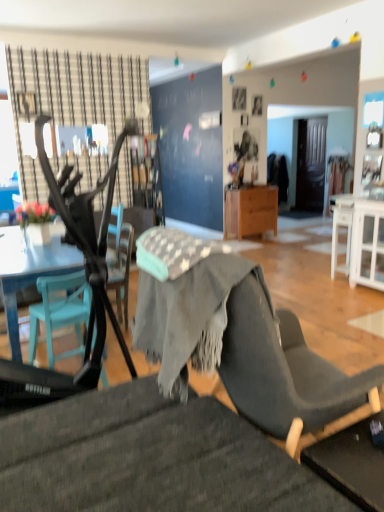
Question: Is teal plastic chair at left, the first chair viewed from the back, looking in the opposite direction of wooden picture frame at upper center, which appears as the second picture frame when viewed from the left?

Choices:
 (A) yes
 (B) no

Answer: (B)

Question: Is teal plastic chair at left, the first chair viewed from the back, not within wooden picture frame at upper center, which appears as the second picture frame when viewed from the left?

Choices:
 (A) no
 (B) yes

Answer: (B)

Question: Can you confirm if teal plastic chair at left, the first chair viewed from the back, is taller than wooden picture frame at upper center, acting as the 1th picture frame starting from the back?

Choices:
 (A) yes
 (B) no

Answer: (A)

Question: Can you confirm if teal plastic chair at left, which appears as the 2th chair when viewed from the front, is smaller than wooden picture frame at upper center, the 1th picture frame from the right?

Choices:
 (A) no
 (B) yes

Answer: (A)

Question: Is wooden picture frame at upper center, acting as the 1th picture frame starting from the back, completely or partially inside teal plastic chair at left, the first chair viewed from the back?

Choices:
 (A) no
 (B) yes

Answer: (A)

Question: Are teal plastic chair at left, the first chair viewed from the back, and wooden picture frame at upper center, acting as the 1th picture frame starting from the back, located far from each other?

Choices:
 (A) yes
 (B) no

Answer: (A)

Question: Can you confirm if wooden picture frame at upper center, the 1th picture frame from the right, is shorter than metallic black feeding chair at left?

Choices:
 (A) no
 (B) yes

Answer: (B)

Question: From a real-world perspective, is wooden picture frame at upper center, which is counted as the 2th picture frame, starting from the front, physically below metallic black feeding chair at left?

Choices:
 (A) no
 (B) yes

Answer: (A)

Question: Is wooden picture frame at upper center, acting as the 1th picture frame starting from the back, to the right of metallic black feeding chair at left from the viewer's perspective?

Choices:
 (A) yes
 (B) no

Answer: (A)

Question: Is wooden picture frame at upper center, which is counted as the 2th picture frame, starting from the front, oriented away from metallic black feeding chair at left?

Choices:
 (A) no
 (B) yes

Answer: (A)

Question: Can we say wooden picture frame at upper center, which is counted as the 2th picture frame, starting from the front, lies outside metallic black feeding chair at left?

Choices:
 (A) yes
 (B) no

Answer: (A)

Question: Would you say wooden picture frame at upper center, the 1th picture frame from the right, contains metallic black feeding chair at left?

Choices:
 (A) no
 (B) yes

Answer: (A)

Question: Is textured gray chair at lower center, which ranks as the 1th chair in front-to-back order, outside of teal plastic chair at left, which appears as the 2th chair when viewed from the front?

Choices:
 (A) no
 (B) yes

Answer: (B)